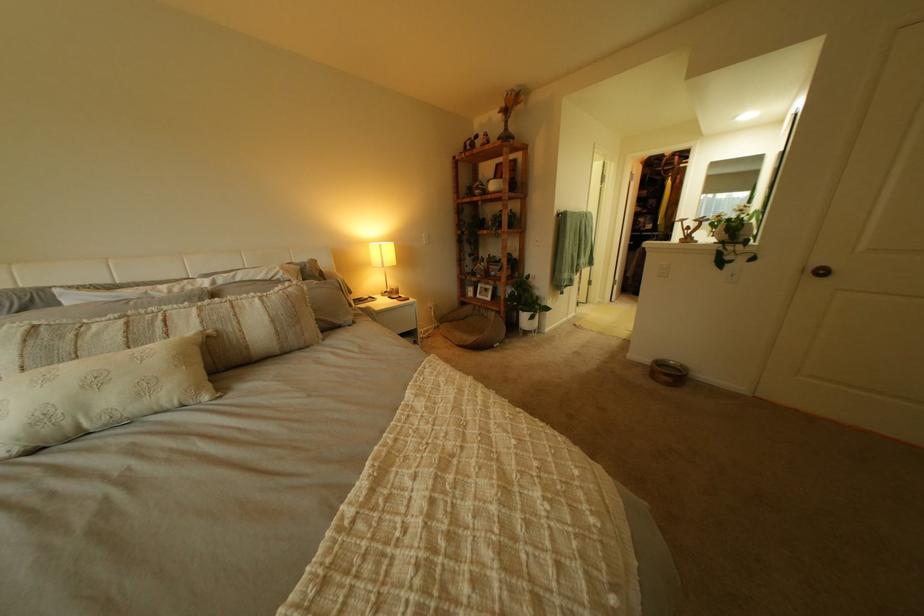
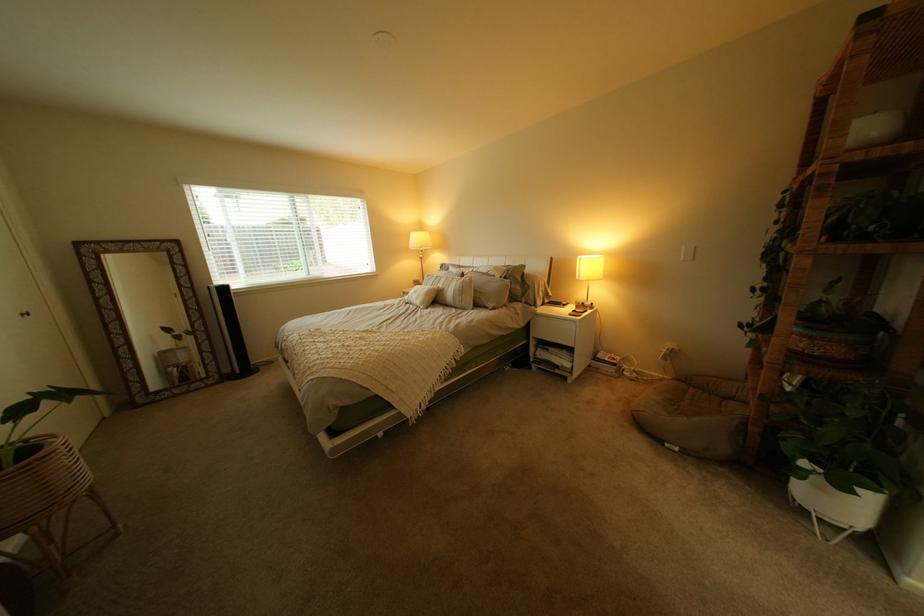
Find the pixel in the second image that matches pixel 305 291 in the first image.

(482, 280)